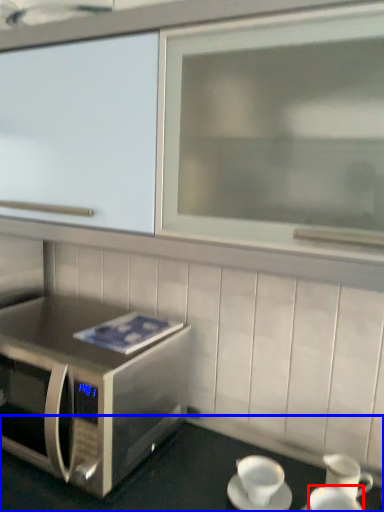
Question: Which object is further to the camera taking this photo, coffee cup (highlighted by a red box) or table (highlighted by a blue box)?

Choices:
 (A) coffee cup
 (B) table

Answer: (A)